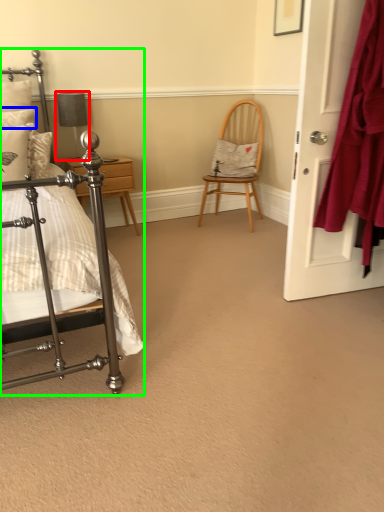
Question: Considering the real-world distances, which object is closest to table lamp (highlighted by a red box)? pillow (highlighted by a blue box) or bed (highlighted by a green box).

Choices:
 (A) pillow
 (B) bed

Answer: (A)